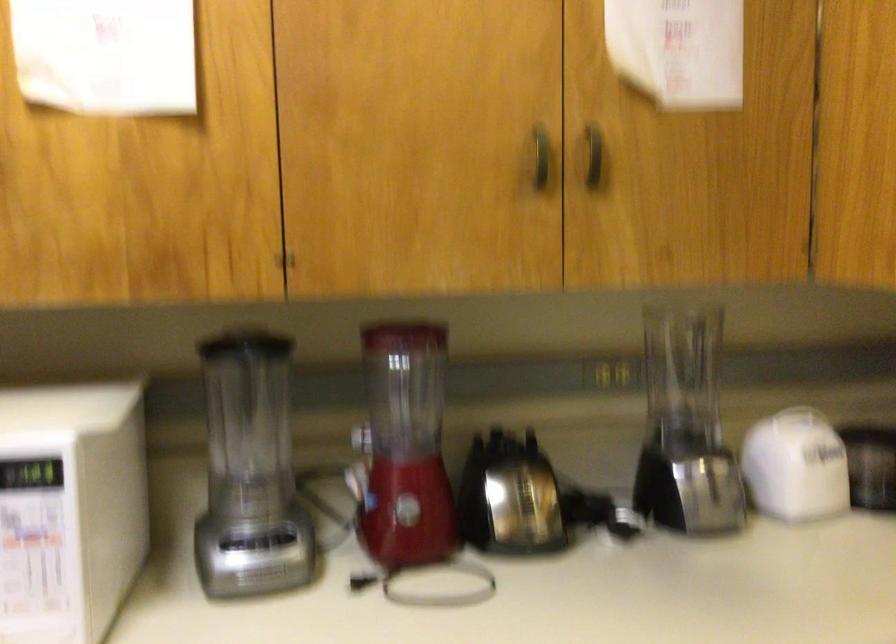
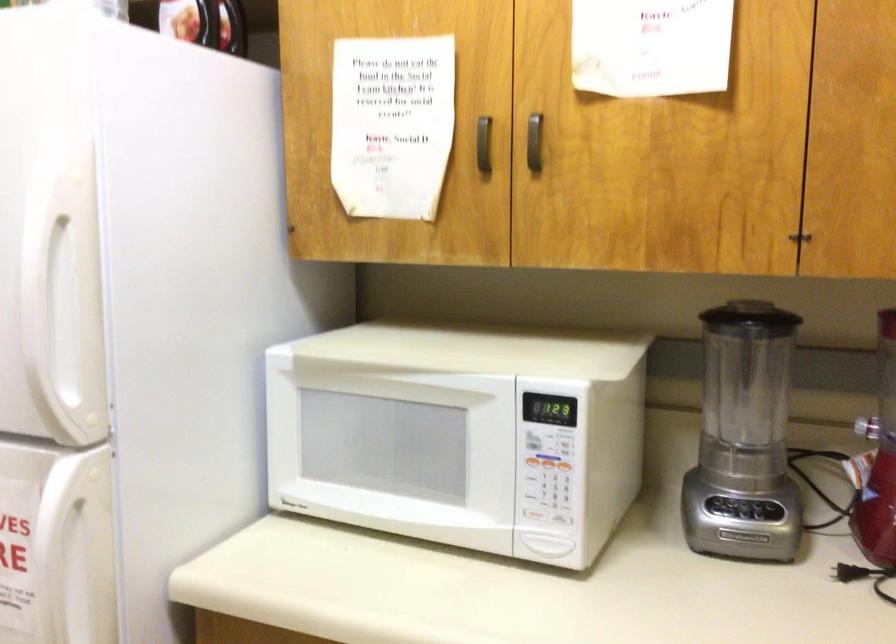
Locate, in the second image, the point that corresponds to pixel 259 547 in the first image.

(744, 512)